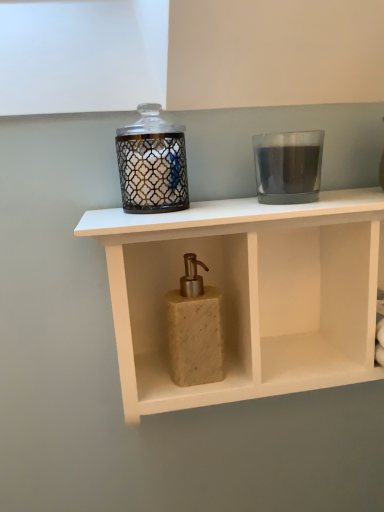
Question: Would you say beige stone soap dispenser at center is to the left or to the right of transparent glass candle at upper right, the second candle holder positioned from the left, in the picture?

Choices:
 (A) left
 (B) right

Answer: (A)

Question: From the image's perspective, is beige stone soap dispenser at center above or below transparent glass candle at upper right, placed as the 1th candle holder when sorted from right to left?

Choices:
 (A) above
 (B) below

Answer: (B)

Question: Which of these objects is positioned farthest from the transparent glass candle at upper right, placed as the 1th candle holder when sorted from right to left?

Choices:
 (A) beige stone soap dispenser at center
 (B) matte glass candle holder at upper center, which is counted as the 2th candle holder, starting from the right
 (C) beige stone soap dispenser at center

Answer: (A)

Question: Which object is positioned farthest from the transparent glass candle at upper right, the second candle holder positioned from the left?

Choices:
 (A) beige stone soap dispenser at center
 (B) matte glass candle holder at upper center, which is counted as the 2th candle holder, starting from the right
 (C) beige stone soap dispenser at center

Answer: (A)